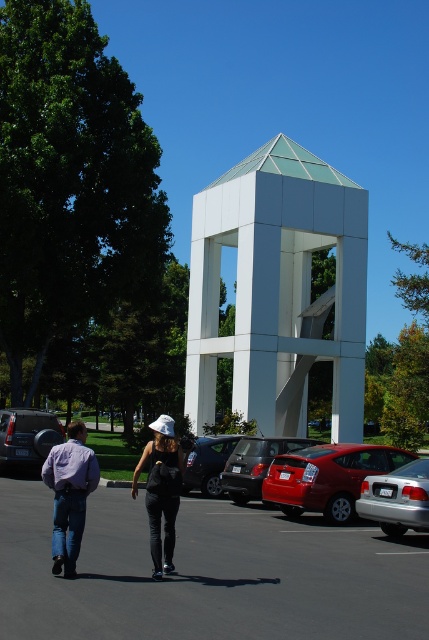
Is point (63, 554) positioned after point (21, 444)?

No, (63, 554) is in front of (21, 444).

Can you confirm if denim jeans at left is positioned above matte black car at left?

No, denim jeans at left is not above matte black car at left.

Who is more distant from viewer, (69,513) or (21,422)?

Positioned behind is point (21,422).

Locate an element on the screen. denim jeans at left is located at coordinates (69, 493).

Between point (235, 339) and point (314, 484), which one is positioned in front?

Positioned in front is point (314, 484).

Is white matte tower at center closer to the viewer compared to shiny red car at lower right?

No, white matte tower at center is behind shiny red car at lower right.

Is point (251, 216) closer to camera compared to point (346, 472)?

No, it is behind (346, 472).

At what (x,y) coordinates should I click in order to perform the action: click on white matte tower at center. Please return your answer as a coordinate pair (x, y). The image size is (429, 640). Looking at the image, I should click on (278, 289).

Between shiny red car at lower right and matte black car at left, which one has more height?

shiny red car at lower right

This screenshot has width=429, height=640. Describe the element at coordinates (328, 477) in the screenshot. I see `shiny red car at lower right` at that location.

Find the location of a particular element. This screenshot has height=640, width=429. shiny red car at lower right is located at coordinates (328, 477).